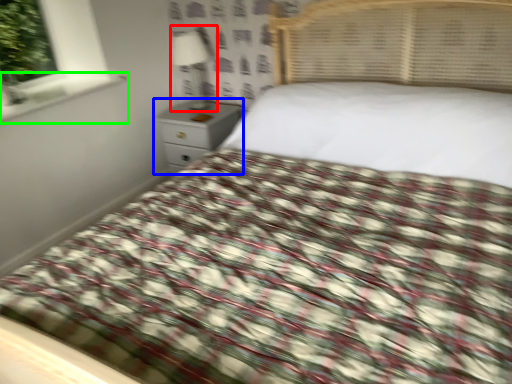
Question: Which is nearer to the lamp (highlighted by a red box)? nightstand (highlighted by a blue box) or window sill (highlighted by a green box).

Choices:
 (A) nightstand
 (B) window sill

Answer: (A)